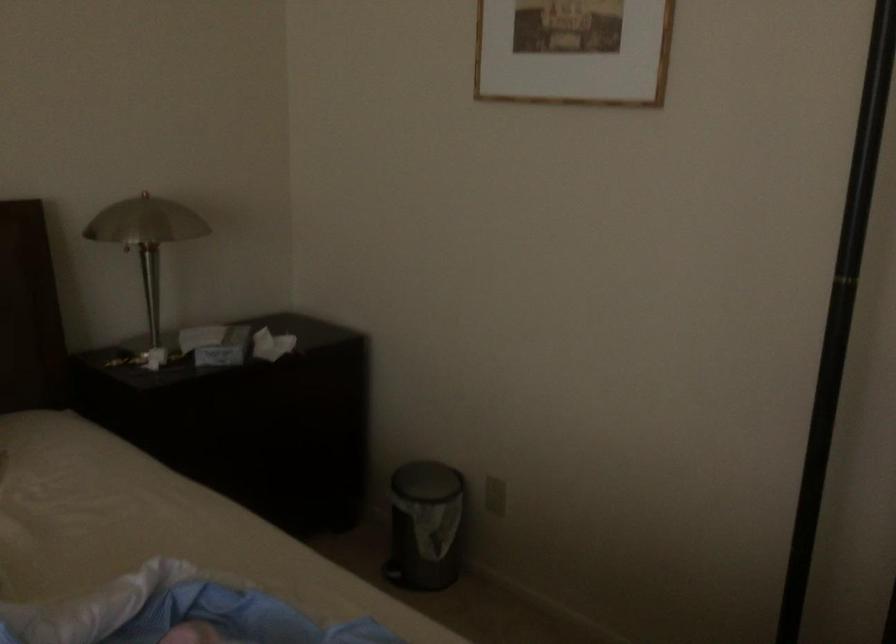
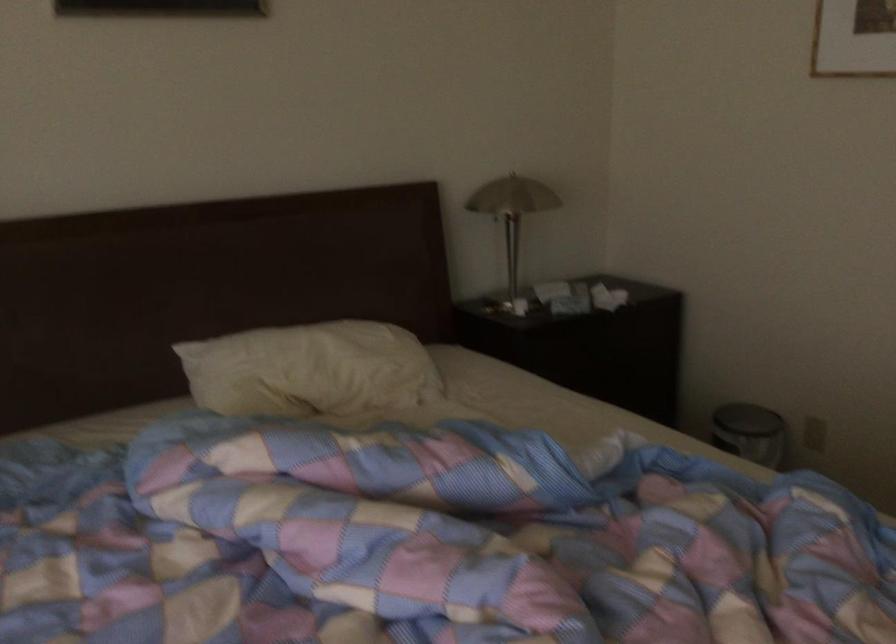
Question: I am providing you with two images of the same scene from different viewpoints. Which of the following objects are not visible in image2?

Choices:
 (A) metal table lamp
 (B) silver keys
 (C) white pillow
 (D) small trash can

Answer: (D)